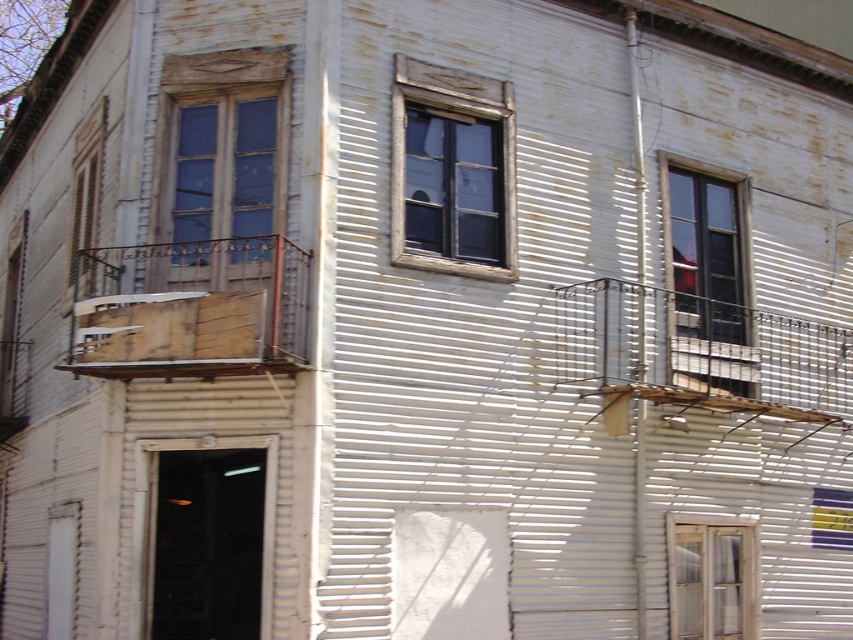
Question: Based on their relative distances, which object is nearer to the wooden frame at upper left?

Choices:
 (A) matte glass window at upper right
 (B) wooden frame at center

Answer: (B)

Question: Which of the following is the farthest from the observer?

Choices:
 (A) (222, 128)
 (B) (720, 547)
 (C) (741, 314)
 (D) (444, 248)

Answer: (C)

Question: Can you confirm if matte glass window at upper right is positioned to the left of wooden frame window at lower right?

Choices:
 (A) yes
 (B) no

Answer: (B)

Question: Can you confirm if wooden frame at upper left is positioned to the left of wooden frame window at lower right?

Choices:
 (A) no
 (B) yes

Answer: (B)

Question: Based on their relative distances, which object is farther from the matte glass window at upper right?

Choices:
 (A) wooden frame window at lower right
 (B) wooden frame at center

Answer: (A)

Question: Is wooden frame at upper left thinner than matte glass window at upper right?

Choices:
 (A) yes
 (B) no

Answer: (B)